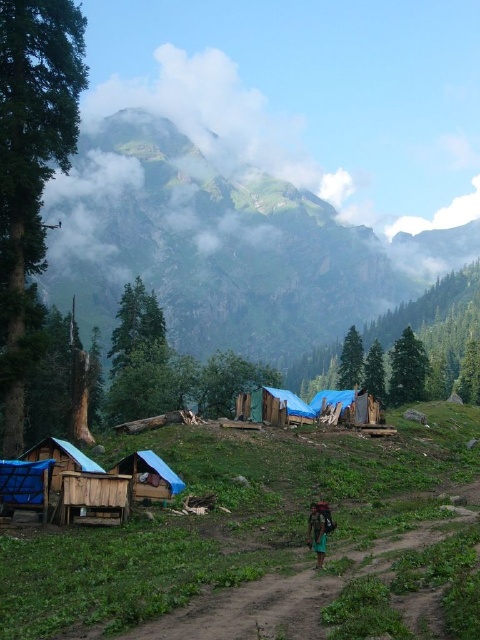
Is wooden hut at lower left above blue tarpaulin tent at center?

Incorrect, wooden hut at lower left is not positioned above blue tarpaulin tent at center.

From the picture: Is wooden hut at lower left wider than blue tarpaulin tent at center?

In fact, wooden hut at lower left might be narrower than blue tarpaulin tent at center.

Is point (91, 509) positioned after point (240, 416)?

No, it is not.

Find the location of a particular element. The height and width of the screenshot is (640, 480). wooden hut at lower left is located at coordinates (94, 497).

Is point (103, 276) positioned after point (149, 467)?

Yes, point (103, 276) is behind point (149, 467).

Looking at this image, can you confirm if green grassy mountain at upper center is shorter than blue tarpaulin tent at lower center?

No.

Is point (122, 179) farther from viewer compared to point (143, 472)?

Yes, it is behind point (143, 472).

Find the location of `green grassy mountain at upper center`. green grassy mountain at upper center is located at coordinates (232, 252).

Which is more to the left, blue tarpaulin tent at lower center or green fabric bag at lower center?

Positioned to the left is blue tarpaulin tent at lower center.

Is point (168, 483) farther from viewer compared to point (311, 545)?

Yes.

You are a GUI agent. You are given a task and a screenshot of the screen. Output one action in this format:
    pyautogui.click(x=<x>, y=<y>)
    Task: Click on the blue tarpaulin tent at lower center
    
    Given the screenshot: What is the action you would take?
    pyautogui.click(x=149, y=476)